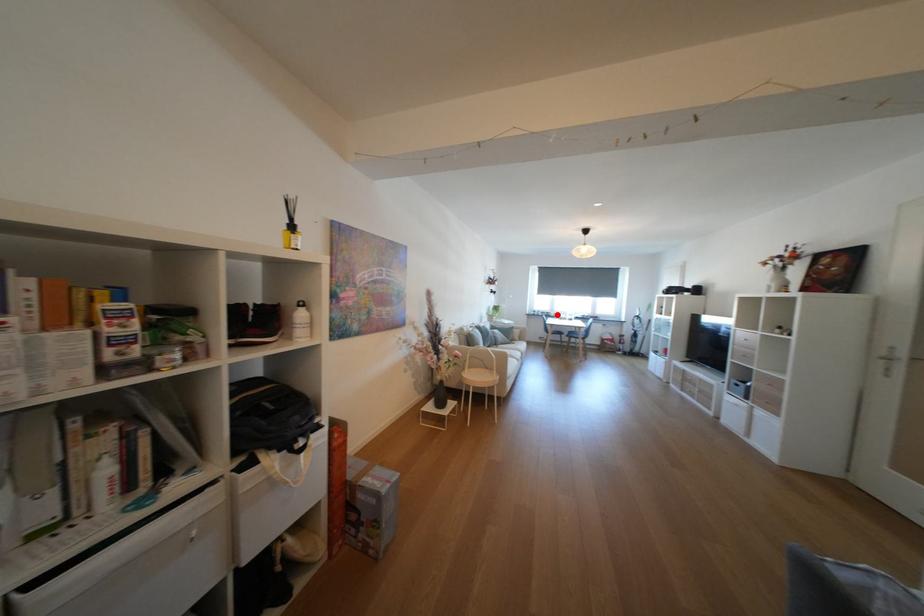
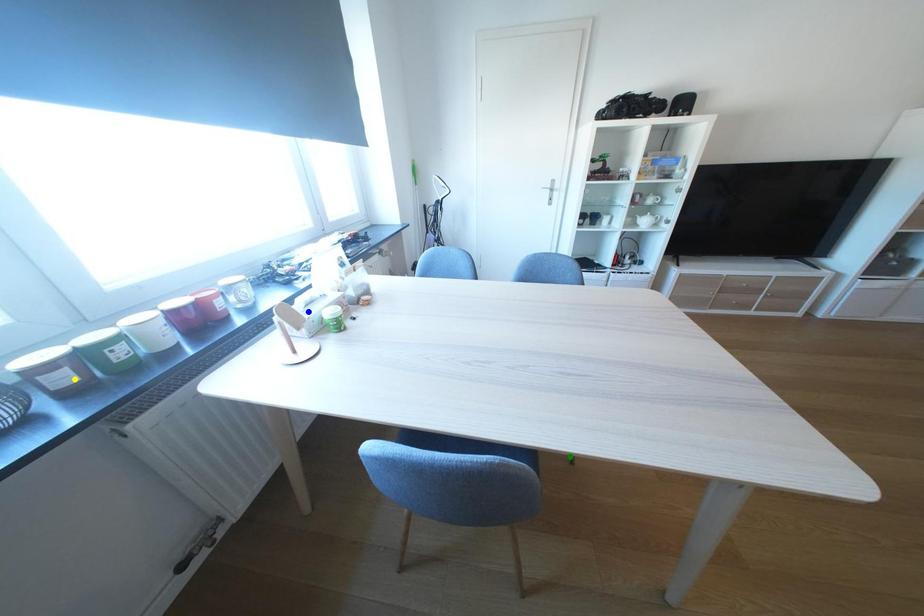
Question: I am providing you with two images of the same scene from different viewpoints. A red point is marked on the first image. You are given multiple points on the second image. In image 2, which mark is for the same physical point as the one in image 1?

Choices:
 (A) green point
 (B) yellow point
 (C) blue point

Answer: (B)